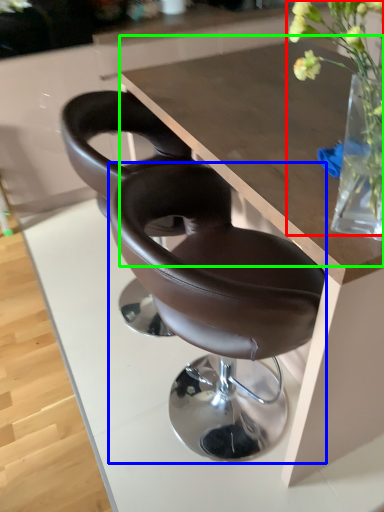
Question: Considering the real-world distances, which object is farthest from floral arrangement (highlighted by a red box)? chair (highlighted by a blue box) or round table (highlighted by a green box)?

Choices:
 (A) chair
 (B) round table

Answer: (B)